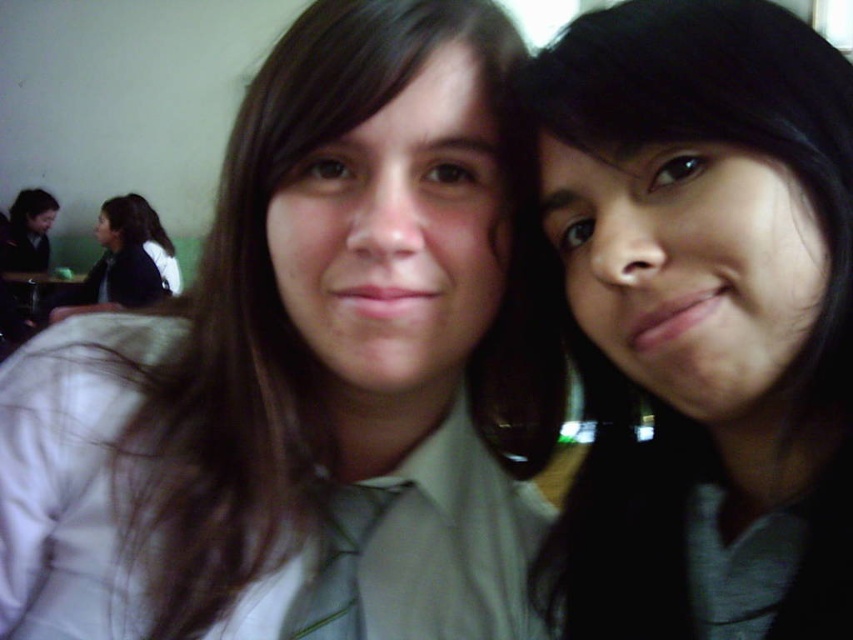
Does point (804, 195) come closer to viewer compared to point (112, 216)?

Yes, it is in front of point (112, 216).

Between matte gray shirt at right and dark brown hair at left, which one appears on the right side from the viewer's perspective?

Positioned to the right is matte gray shirt at right.

Describe the element at coordinates (701, 321) in the screenshot. I see `matte gray shirt at right` at that location.

Where is `matte gray shirt at right`? matte gray shirt at right is located at coordinates (701, 321).

Between point (173, 369) and point (660, 132), which one is positioned behind?

Point (173, 369)

Which is behind, point (77, 618) or point (724, 150)?

Positioned behind is point (77, 618).

You are a GUI agent. You are given a task and a screenshot of the screen. Output one action in this format:
    pyautogui.click(x=<x>, y=<y>)
    Task: Click on the matte gray shirt at center
    
    Given the screenshot: What is the action you would take?
    pyautogui.click(x=309, y=371)

The width and height of the screenshot is (853, 640). Identify the location of matte gray shirt at center. (309, 371).

Identify the location of matte gray shirt at center. (309, 371).